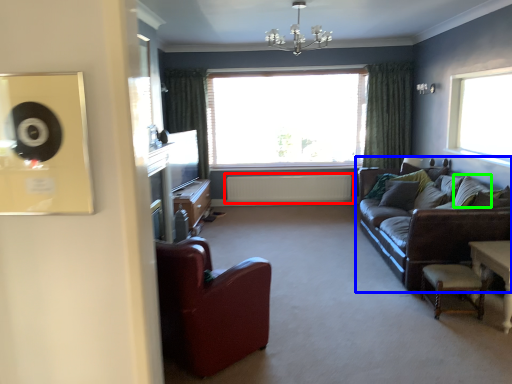
Question: Estimate the real-world distances between objects in this image. Which object is farther from radiator (highlighted by a red box), studio couch (highlighted by a blue box) or pillow (highlighted by a green box)?

Choices:
 (A) studio couch
 (B) pillow

Answer: (B)